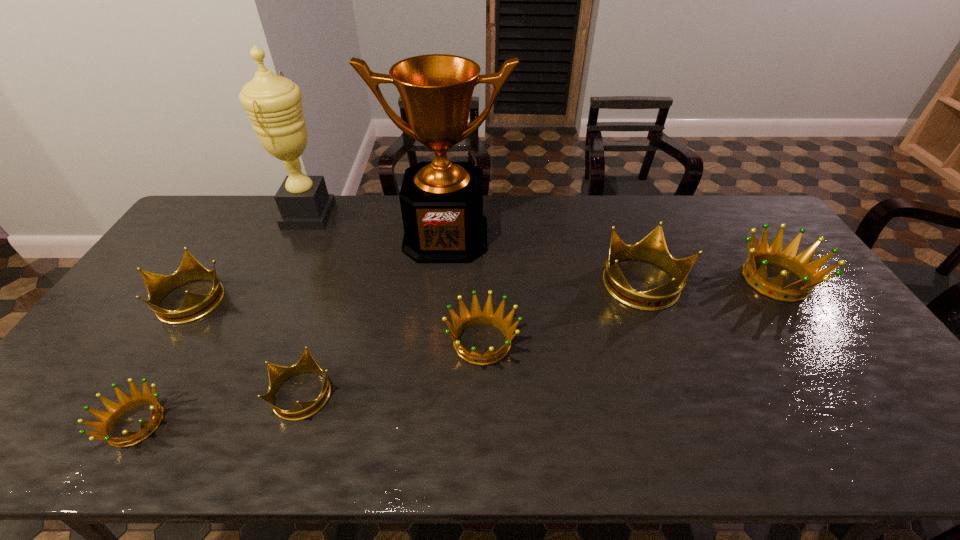
I want to click on the second gold crown from left to right, so click(x=278, y=375).

Identify the location of the nearest gold crown. (278, 375).

The height and width of the screenshot is (540, 960). Identify the location of the leftmost golden crown. (126, 403).

Identify the location of the nearest golden crown. (126, 403).

The width and height of the screenshot is (960, 540). I want to click on free point located 0.370m at the front of the yellow trophy cup with handles, so click(435, 215).

Find the location of a particular element. The height and width of the screenshot is (540, 960). free region located on the front of the right trophy cup with the label is located at coordinates (437, 335).

Locate an element on the screen. Image resolution: width=960 pixels, height=540 pixels. free space located on the right of the biggest gold crown is located at coordinates (702, 285).

Find the location of a particular element. The width and height of the screenshot is (960, 540). free location located on the front of the farthest golden crown is located at coordinates (872, 420).

At what (x,y) coordinates should I click in order to perform the action: click on vacant area situated 0.390m on the back of the second smallest gold crown. Please return your answer as a coordinate pair (x, y). The height and width of the screenshot is (540, 960). Looking at the image, I should click on (252, 203).

The height and width of the screenshot is (540, 960). I want to click on vacant area located on the front of the second golden crown from right to left, so click(x=483, y=422).